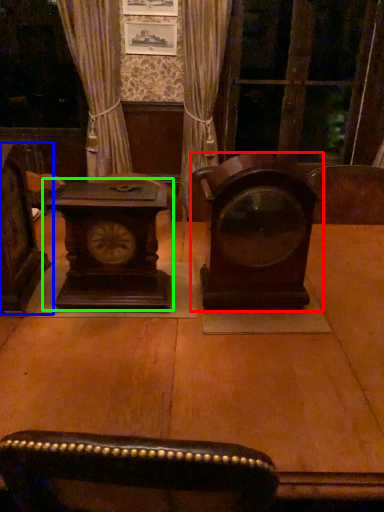
Question: Considering the real-world distances, which object is closest to alarm clock (highlighted by a red box)? furniture (highlighted by a blue box) or alarm clock (highlighted by a green box).

Choices:
 (A) furniture
 (B) alarm clock

Answer: (B)